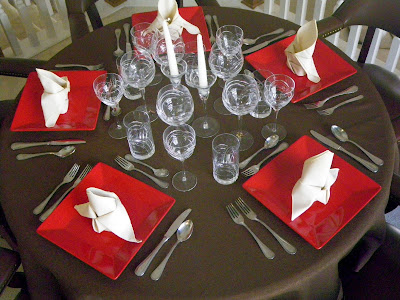
The width and height of the screenshot is (400, 300). Find the location of `fancy napkins`. fancy napkins is located at coordinates (314, 180), (125, 215), (63, 79), (174, 19), (304, 40).